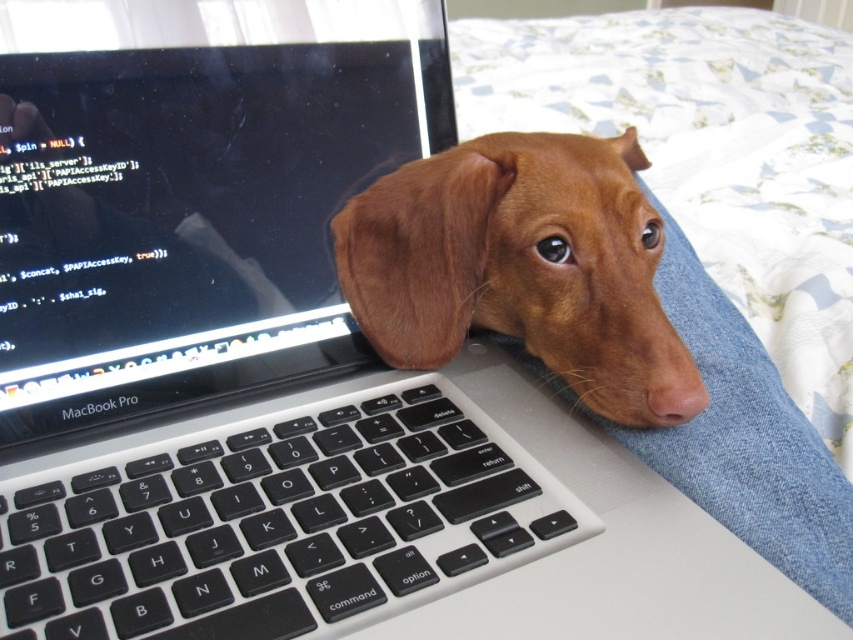
Question: Which point appears closest to the camera in this image?

Choices:
 (A) (502, 280)
 (B) (335, 593)
 (C) (309, 333)

Answer: (B)

Question: Can you confirm if brown fur dog at center is smaller than pink matte/natural nose at center?

Choices:
 (A) yes
 (B) no

Answer: (B)

Question: Which point is farther from the camera taking this photo?

Choices:
 (A) (299, 552)
 (B) (654, 394)
 (C) (280, 177)
 (D) (338, 252)

Answer: (D)

Question: Does black matte keyboard at center come in front of brown fur dog at center?

Choices:
 (A) no
 (B) yes

Answer: (B)

Question: Does black matte keyboard at center appear under pink matte/natural nose at center?

Choices:
 (A) no
 (B) yes

Answer: (B)

Question: Which of the following is the closest to the observer?

Choices:
 (A) black matte keyboard at center
 (B) brown fur dog at center

Answer: (A)